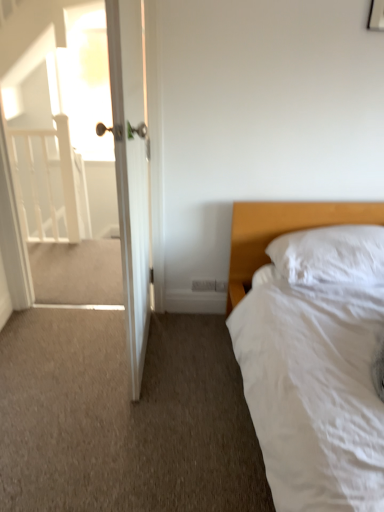
Question: Is white wooden door at left located within white soft pillow at right?

Choices:
 (A) no
 (B) yes

Answer: (A)

Question: From a real-world perspective, is white soft pillow at right beneath white wooden door at left?

Choices:
 (A) yes
 (B) no

Answer: (A)

Question: Is white soft pillow at right wider than white wooden door at left?

Choices:
 (A) no
 (B) yes

Answer: (B)

Question: Is white soft pillow at right taller than white wooden door at left?

Choices:
 (A) no
 (B) yes

Answer: (A)

Question: Is white soft pillow at right further to the viewer compared to white wooden door at left?

Choices:
 (A) no
 (B) yes

Answer: (B)

Question: Is white soft pillow at right touching white wooden door at left?

Choices:
 (A) yes
 (B) no

Answer: (B)

Question: Does white glossy door at upper left have a greater width compared to white wooden door at left?

Choices:
 (A) no
 (B) yes

Answer: (B)

Question: Can you confirm if white glossy door at upper left is taller than white wooden door at left?

Choices:
 (A) no
 (B) yes

Answer: (A)

Question: Can you confirm if white glossy door at upper left is bigger than white wooden door at left?

Choices:
 (A) yes
 (B) no

Answer: (B)

Question: Is white glossy door at upper left in contact with white wooden door at left?

Choices:
 (A) no
 (B) yes

Answer: (A)

Question: Is white wooden door at left completely or partially inside white glossy door at upper left?

Choices:
 (A) no
 (B) yes

Answer: (A)

Question: From a real-world perspective, is white glossy door at upper left physically above white wooden door at left?

Choices:
 (A) no
 (B) yes

Answer: (B)

Question: From the image's perspective, does white wooden balustrade at left appear higher than white wooden door at left?

Choices:
 (A) no
 (B) yes

Answer: (B)